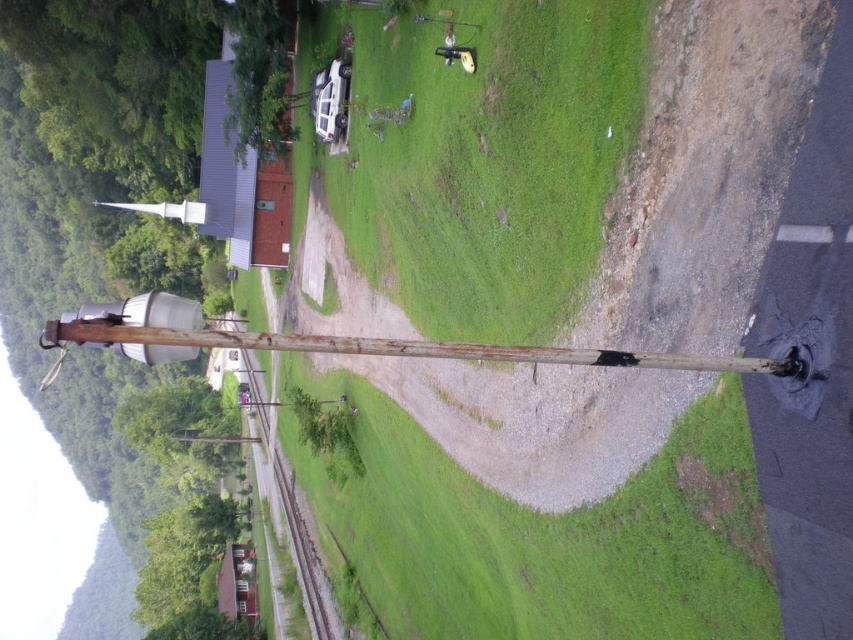
What do you see at coordinates (556, 176) in the screenshot?
I see `green grassy at center` at bounding box center [556, 176].

Can you confirm if green grassy at center is positioned to the right of rusty wood pole at left?

Correct, you'll find green grassy at center to the right of rusty wood pole at left.

Is point (444, 294) closer to camera compared to point (457, 348)?

That is False.

This screenshot has height=640, width=853. I want to click on green grassy at center, so click(556, 176).